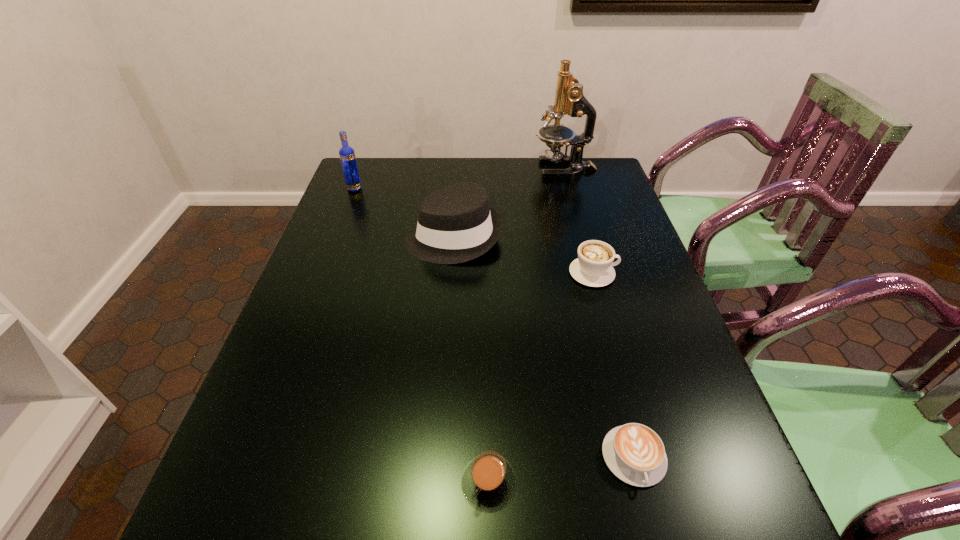
The height and width of the screenshot is (540, 960). I want to click on cappuccino identified as the second closest to the second shortest object, so click(x=593, y=267).

The width and height of the screenshot is (960, 540). Identify the location of vacant space that satisfies the following two spatial constraints: 1. at the eyepiece of the farthest object; 2. on the side of the shortest object with the handle. (644, 457).

I want to click on free region that satisfies the following two spatial constraints: 1. at the eyepiece of the microscope; 2. on the side of the shortest cappuccino with the handle, so click(644, 457).

This screenshot has height=540, width=960. What are the coordinates of `vacant space that satisfies the following two spatial constraints: 1. at the eyepiece of the farthest object; 2. on the front side of the fourth shortest object` in the screenshot? It's located at (583, 237).

Identify the location of vacant space that satisfies the following two spatial constraints: 1. on the front side of the fifth tallest object; 2. on the left side of the fedora. This screenshot has width=960, height=540. (436, 482).

Image resolution: width=960 pixels, height=540 pixels. What are the coordinates of `free region that satisfies the following two spatial constraints: 1. to the right of the tallest cappuccino's handle; 2. on the side of the shortest cappuccino with the handle` in the screenshot? It's located at (644, 457).

Where is `free location that satisfies the following two spatial constraints: 1. at the eyepiece of the tallest object; 2. on the side of the shortest object with the handle`? The image size is (960, 540). free location that satisfies the following two spatial constraints: 1. at the eyepiece of the tallest object; 2. on the side of the shortest object with the handle is located at coordinates (x=644, y=457).